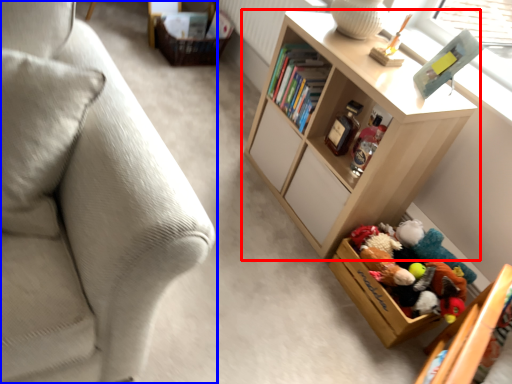
Question: Which object appears closest to the camera in this image, shelf (highlighted by a red box) or studio couch (highlighted by a blue box)?

Choices:
 (A) shelf
 (B) studio couch

Answer: (B)